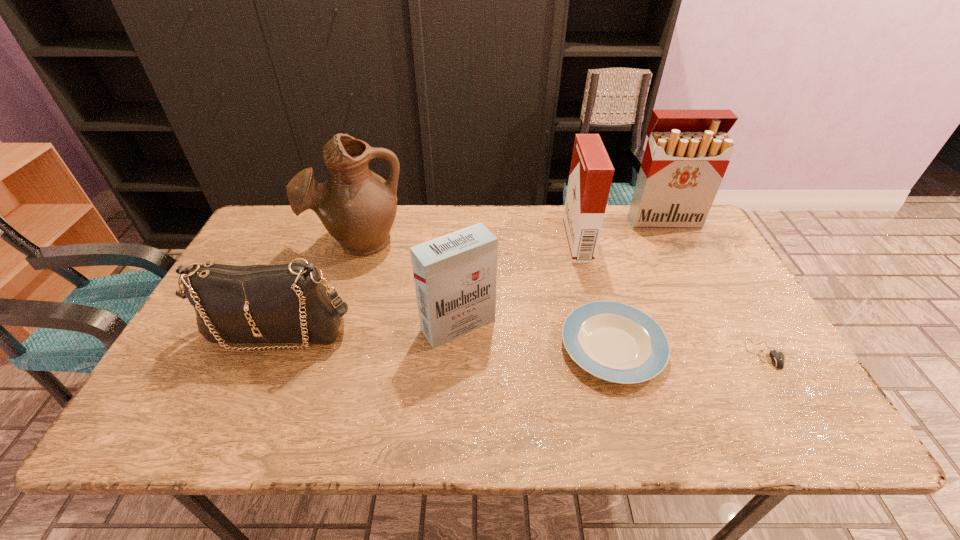
Where is `the rightmost cigarette case`? Image resolution: width=960 pixels, height=540 pixels. the rightmost cigarette case is located at coordinates coord(687,154).

Locate an element on the screen. The width and height of the screenshot is (960, 540). pitcher is located at coordinates (357, 207).

Locate an element on the screen. This screenshot has height=540, width=960. the second cigarette case from right to left is located at coordinates (591, 173).

This screenshot has width=960, height=540. In order to click on the shortest cigarette case in this screenshot , I will do `click(455, 275)`.

Locate an element on the screen. the fifth object from right to left is located at coordinates (455, 275).

Image resolution: width=960 pixels, height=540 pixels. Identify the location of handbag. pyautogui.click(x=288, y=303).

Where is `the second shortest object`? the second shortest object is located at coordinates (616, 342).

Locate an element on the screen. This screenshot has height=540, width=960. the shortest object is located at coordinates (777, 358).

Identify the location of vacant space located 0.070m with the lid open on the rightmost cigarette case. This screenshot has width=960, height=540. (674, 244).

At what (x,y) coordinates should I click in order to perform the action: click on free space located 0.260m at the spout of the pitcher. Please return your answer as a coordinate pair (x, y). Looking at the image, I should click on (329, 334).